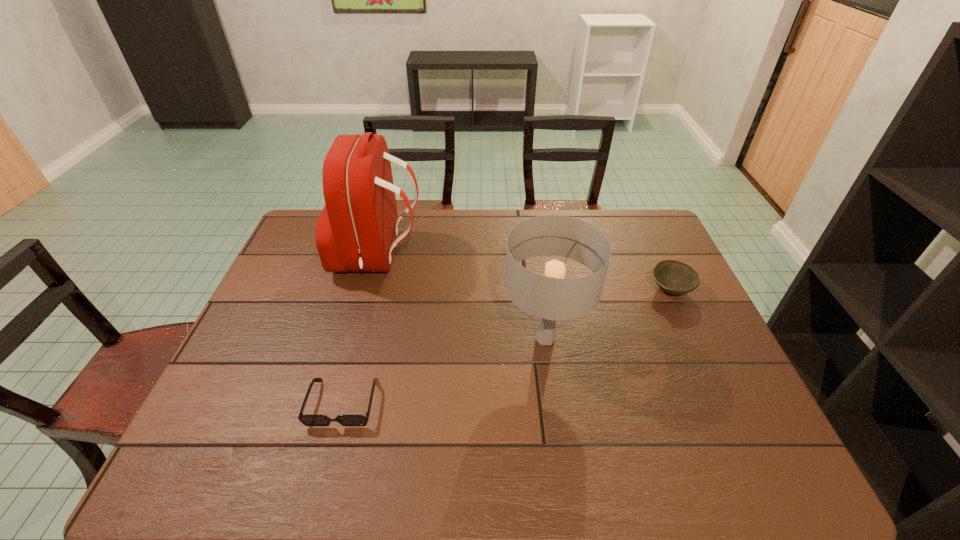
Image resolution: width=960 pixels, height=540 pixels. What are the coordinates of `free location located on the front-facing side of the third object from left to right` in the screenshot? It's located at (469, 338).

The image size is (960, 540). Find the location of `free space located 0.380m on the back of the rightmost object`. free space located 0.380m on the back of the rightmost object is located at coordinates (633, 209).

Identify the location of vacant area situated 0.050m on the front-facing side of the sunglasses. (330, 450).

I want to click on object that is at the far edge, so click(357, 231).

You are a GUI agent. You are given a task and a screenshot of the screen. Output one action in this format:
    pyautogui.click(x=<x>, y=<y>)
    Task: Click on the object positioned at the right edge
    This screenshot has height=540, width=960.
    Given the screenshot: What is the action you would take?
    pyautogui.click(x=674, y=277)

Where is `vacant area at the far edge of the desktop`? This screenshot has width=960, height=540. vacant area at the far edge of the desktop is located at coordinates (518, 215).

I want to click on free region at the left edge of the desktop, so click(x=282, y=271).

Find the location of a particular element. blank space at the right edge of the desktop is located at coordinates (670, 314).

The width and height of the screenshot is (960, 540). Find the location of `free region at the far left corner`. free region at the far left corner is located at coordinates (309, 246).

In order to click on vacant space at the far right corner in this screenshot , I will do click(632, 215).